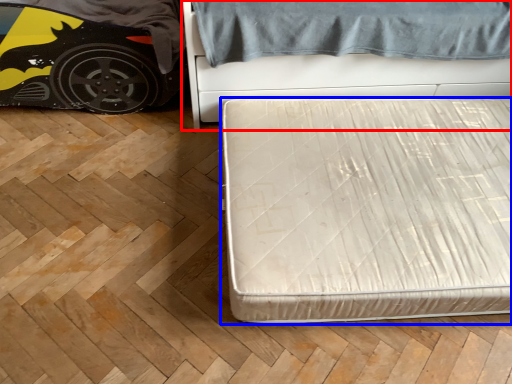
Question: Which point is further to the camera, bed (highlighted by a red box) or bed (highlighted by a blue box)?

Choices:
 (A) bed
 (B) bed

Answer: (A)